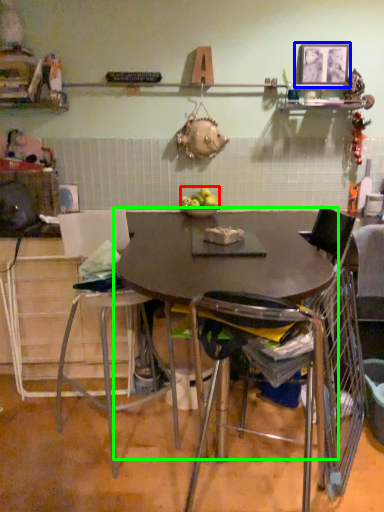
Question: Which object is positioned farthest from apple (highlighted by a red box)? Select from picture frame (highlighted by a blue box) and table (highlighted by a green box).

Choices:
 (A) picture frame
 (B) table

Answer: (A)